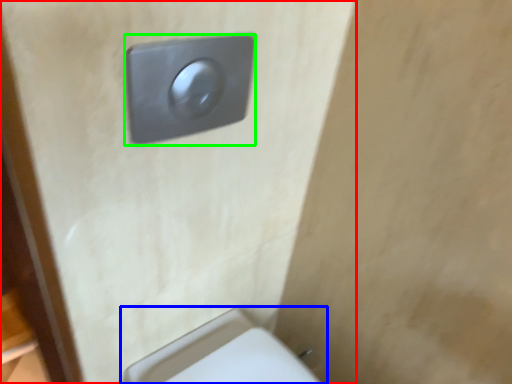
Question: Considering the real-world distances, which object is farthest from door (highlighted by a red box)? toilet (highlighted by a blue box) or light switch (highlighted by a green box)?

Choices:
 (A) toilet
 (B) light switch

Answer: (A)